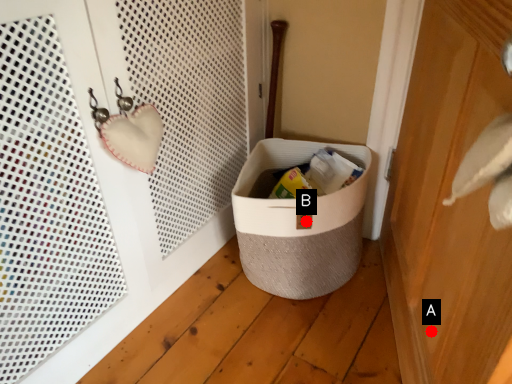
Question: Two points are circled on the image, labeled by A and B beside each circle. Among these points, which one is nearest to the camera?

Choices:
 (A) A is closer
 (B) B is closer

Answer: (A)